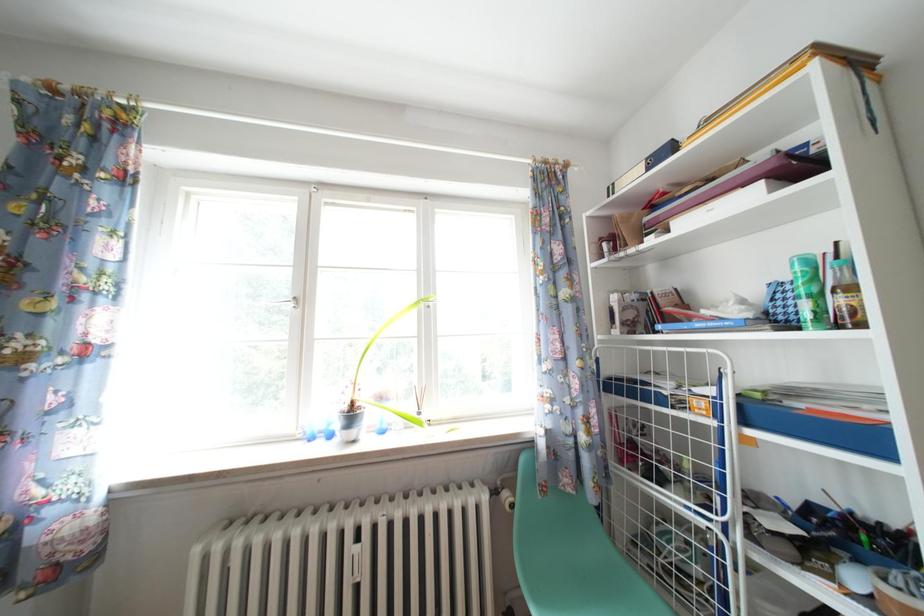
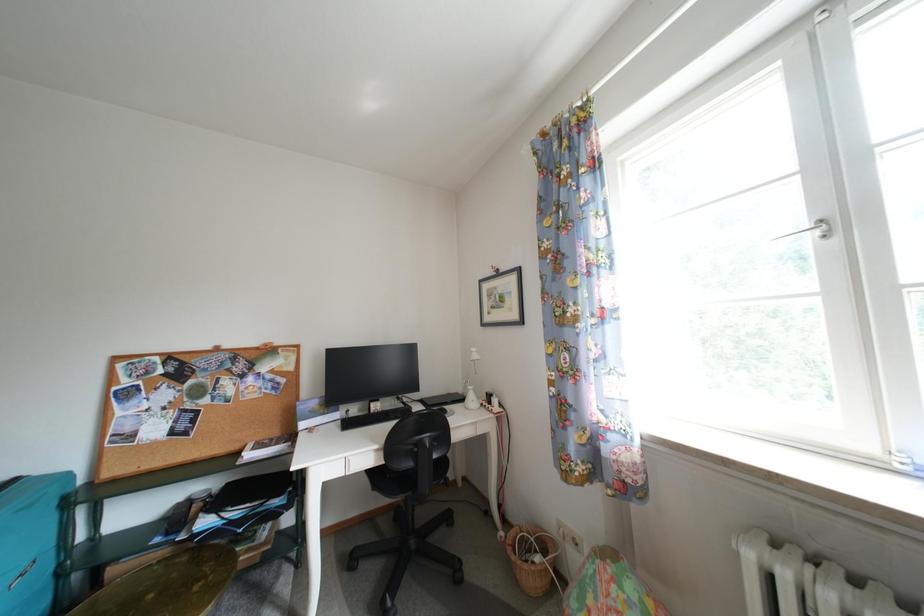
Question: The camera is either moving clockwise (left) or counter-clockwise (right) around the object. The first image is from the beginning of the video and the second image is from the end. Is the camera moving left or right when shooting the video?

Choices:
 (A) Left
 (B) Right

Answer: (B)